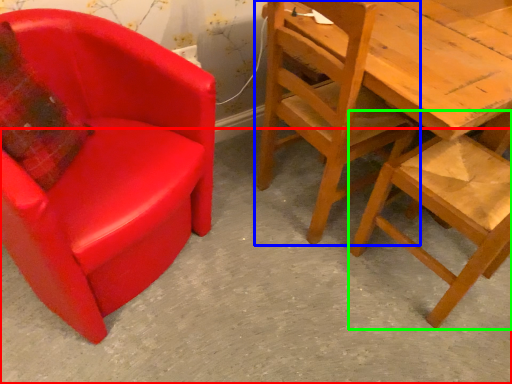
Question: Based on their relative distances, which object is farther from concrete (highlighted by a red box)? Choose from chair (highlighted by a blue box) and chair (highlighted by a green box).

Choices:
 (A) chair
 (B) chair

Answer: (A)